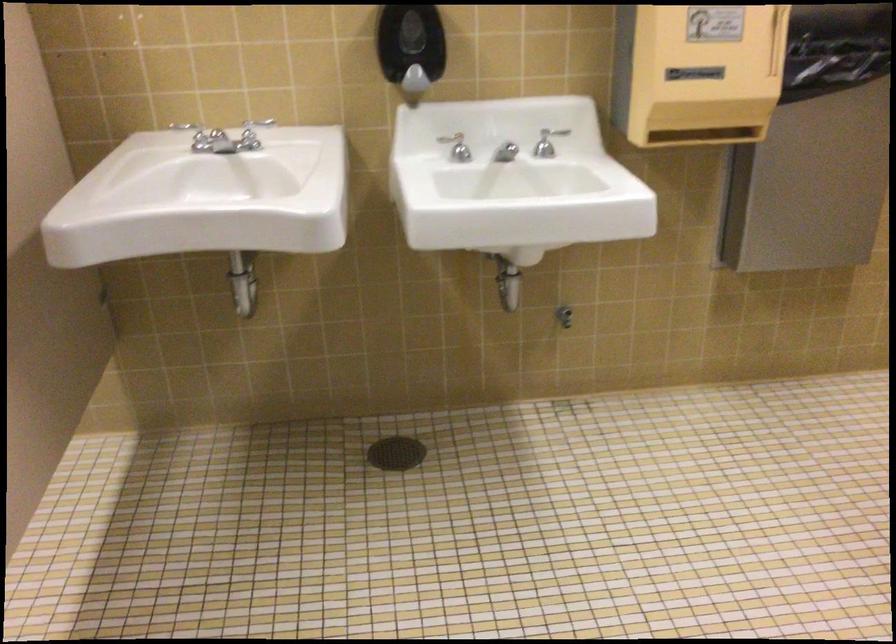
What do you see at coordinates (412, 84) in the screenshot?
I see `the soap dispenser lever` at bounding box center [412, 84].